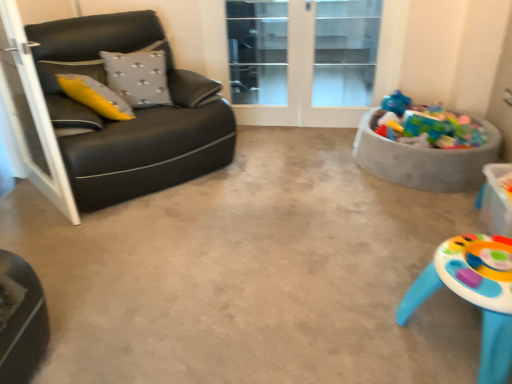
At what (x,y) coordinates should I click in order to perform the action: click on vacant space to the right of black leather couch at left, which ranks as the 1th screen door in front-to-back order. Please return your answer as a coordinate pair (x, y). The height and width of the screenshot is (384, 512). Looking at the image, I should click on (139, 213).